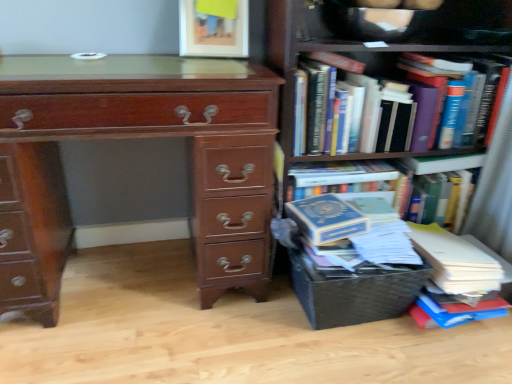
Question: From a real-world perspective, is woven brown crate at lower right physically above blue hardcover book at right, positioned as the second book in top-to-bottom order?

Choices:
 (A) no
 (B) yes

Answer: (A)

Question: Does woven brown crate at lower right have a larger size compared to blue hardcover book at right, positioned as the 1th book in bottom-to-top order?

Choices:
 (A) yes
 (B) no

Answer: (B)

Question: Considering the relative sizes of woven brown crate at lower right and blue hardcover book at right, positioned as the second book in top-to-bottom order, in the image provided, is woven brown crate at lower right thinner than blue hardcover book at right, positioned as the second book in top-to-bottom order,?

Choices:
 (A) no
 (B) yes

Answer: (B)

Question: Does woven brown crate at lower right lie in front of blue hardcover book at right, positioned as the second book in top-to-bottom order?

Choices:
 (A) no
 (B) yes

Answer: (B)

Question: Is woven brown crate at lower right touching blue hardcover book at right, positioned as the 1th book in bottom-to-top order?

Choices:
 (A) no
 (B) yes

Answer: (A)

Question: Is woven brown crate at lower right far away from blue hardcover book at right, positioned as the second book in top-to-bottom order?

Choices:
 (A) yes
 (B) no

Answer: (B)

Question: Considering the relative sizes of hardcover books at upper right, which ranks as the second book in bottom-to-top order, and blue hardcover book at right, positioned as the 1th book in bottom-to-top order, in the image provided, is hardcover books at upper right, which ranks as the second book in bottom-to-top order, smaller than blue hardcover book at right, positioned as the 1th book in bottom-to-top order,?

Choices:
 (A) no
 (B) yes

Answer: (B)

Question: Can you confirm if hardcover books at upper right, the 1th book from the top, is wider than blue hardcover book at right, positioned as the second book in top-to-bottom order?

Choices:
 (A) yes
 (B) no

Answer: (B)

Question: Is hardcover books at upper right, which ranks as the second book in bottom-to-top order, turned away from blue hardcover book at right, positioned as the 1th book in bottom-to-top order?

Choices:
 (A) yes
 (B) no

Answer: (B)

Question: Considering the relative sizes of hardcover books at upper right, which ranks as the second book in bottom-to-top order, and blue hardcover book at right, positioned as the second book in top-to-bottom order, in the image provided, is hardcover books at upper right, which ranks as the second book in bottom-to-top order, taller than blue hardcover book at right, positioned as the second book in top-to-bottom order,?

Choices:
 (A) no
 (B) yes

Answer: (A)

Question: Can you confirm if hardcover books at upper right, which ranks as the second book in bottom-to-top order, is positioned to the left of blue hardcover book at right, positioned as the second book in top-to-bottom order?

Choices:
 (A) no
 (B) yes

Answer: (A)

Question: Does hardcover books at upper right, the 1th book from the top, come behind blue hardcover book at right, positioned as the second book in top-to-bottom order?

Choices:
 (A) yes
 (B) no

Answer: (B)

Question: From a real-world perspective, is shiny brown wooden chest of drawers at left over blue hardcover book at right, positioned as the 1th book in bottom-to-top order?

Choices:
 (A) no
 (B) yes

Answer: (B)